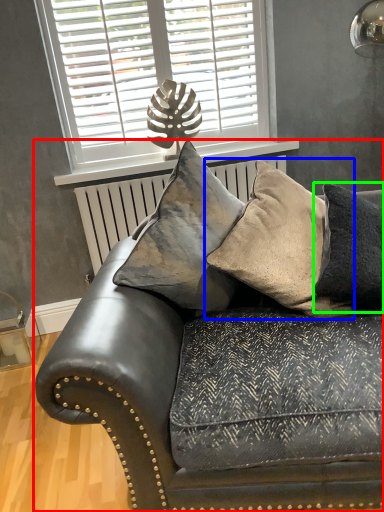
Question: Based on their relative distances, which object is farther from studio couch (highlighted by a red box)? Choose from pillow (highlighted by a blue box) and pillow (highlighted by a green box).

Choices:
 (A) pillow
 (B) pillow

Answer: (B)